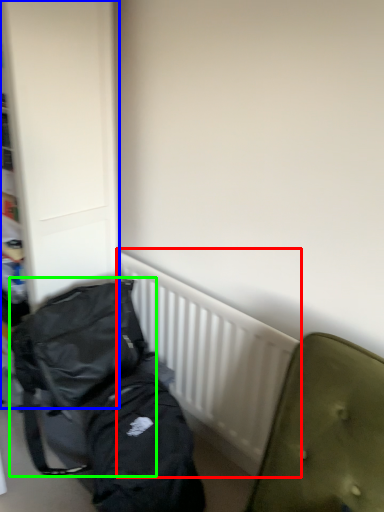
Question: Based on their relative distances, which object is farther from radiator (highlighted by a red box)? Choose from dresser (highlighted by a blue box) and backpack (highlighted by a green box).

Choices:
 (A) dresser
 (B) backpack

Answer: (A)